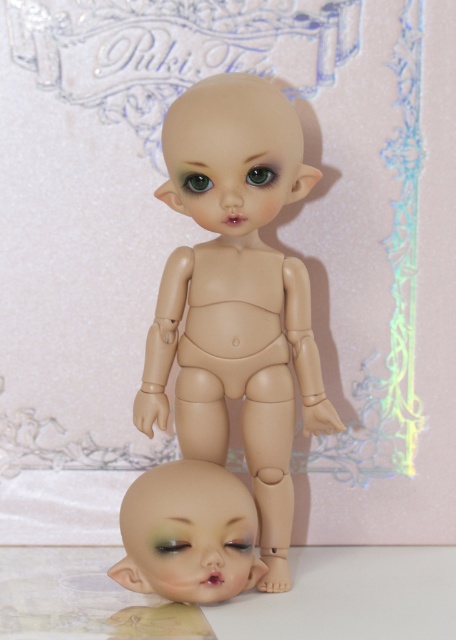
Question: Among these objects, which one is nearest to the camera?

Choices:
 (A) matte plastic head at lower center
 (B) matte beige doll at center

Answer: (A)

Question: Does matte beige doll at center come in front of matte plastic head at lower center?

Choices:
 (A) yes
 (B) no

Answer: (B)

Question: Which of the following is the closest to the observer?

Choices:
 (A) matte beige doll at center
 (B) matte plastic head at lower center

Answer: (B)

Question: In this image, where is matte beige doll at center located relative to matte plastic head at lower center?

Choices:
 (A) below
 (B) above

Answer: (B)

Question: Does matte beige doll at center appear on the left side of matte plastic head at lower center?

Choices:
 (A) yes
 (B) no

Answer: (B)